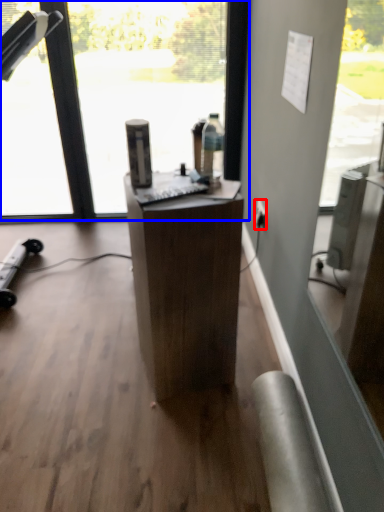
Question: Which object is closer to the camera taking this photo, power outlet (highlighted by a red box) or window (highlighted by a blue box)?

Choices:
 (A) power outlet
 (B) window

Answer: (B)